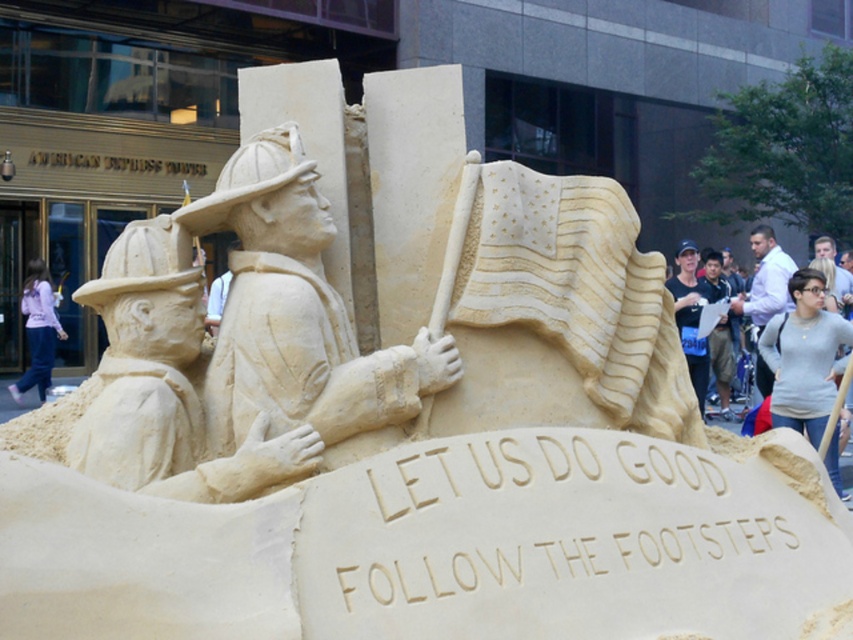
Question: In this image, where is matte sand firefighter at left located relative to matte beige sand sculpture at center?

Choices:
 (A) right
 (B) left

Answer: (B)

Question: Among these objects, which one is nearest to the camera?

Choices:
 (A) beige sand sculpture at center
 (B) matte beige sand sculpture at center
 (C) white shirt at right

Answer: (A)

Question: Among these objects, which one is nearest to the camera?

Choices:
 (A) white shirt at right
 (B) beige sand sculpture at center

Answer: (B)

Question: Does matte sand firefighter at left have a smaller size compared to white shirt at right?

Choices:
 (A) no
 (B) yes

Answer: (B)

Question: Which point is closer to the camera taking this photo?

Choices:
 (A) (178, 269)
 (B) (328, 332)
 (C) (692, 326)

Answer: (B)

Question: Is matte sand firefighter at left bigger than white shirt at right?

Choices:
 (A) yes
 (B) no

Answer: (B)